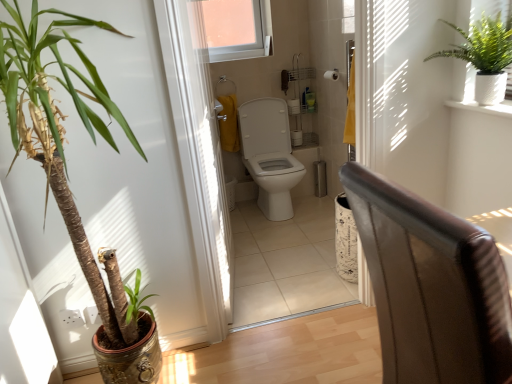
Locate an element on the screen. Image resolution: width=512 pixels, height=384 pixels. vacant space underneath white plastic screen door at center (from a real-world perspective) is located at coordinates (237, 278).